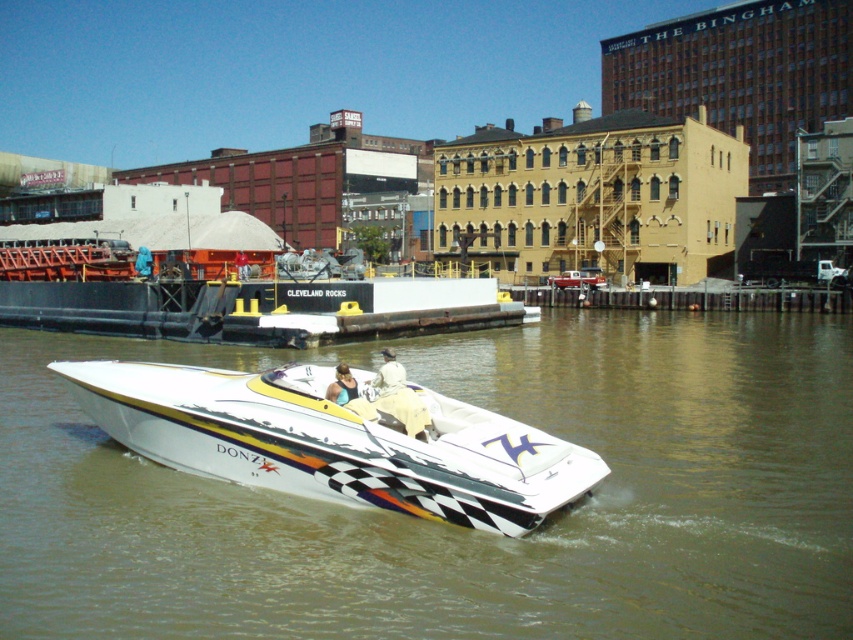
Question: Which of the following is the closest to the observer?

Choices:
 (A) tan fabric jacket at center
 (B) white glossy speedboat at center
 (C) white glossy water at center

Answer: (C)

Question: Which of the following is the farthest from the observer?

Choices:
 (A) (424, 397)
 (B) (62, 488)

Answer: (B)

Question: Is the position of white glossy speedboat at center more distant than that of tan fabric jacket at center?

Choices:
 (A) yes
 (B) no

Answer: (A)

Question: Is white glossy water at center positioned before white glossy speedboat at center?

Choices:
 (A) no
 (B) yes

Answer: (B)

Question: Which of the following is the farthest from the observer?

Choices:
 (A) white glossy water at center
 (B) tan fabric jacket at center

Answer: (B)

Question: Is white glossy water at center wider than tan fabric jacket at center?

Choices:
 (A) no
 (B) yes

Answer: (B)